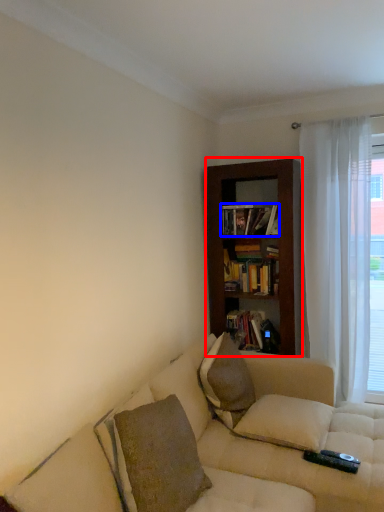
Question: Which point is closer to the camera, bookcase (highlighted by a red box) or book (highlighted by a blue box)?

Choices:
 (A) bookcase
 (B) book

Answer: (A)